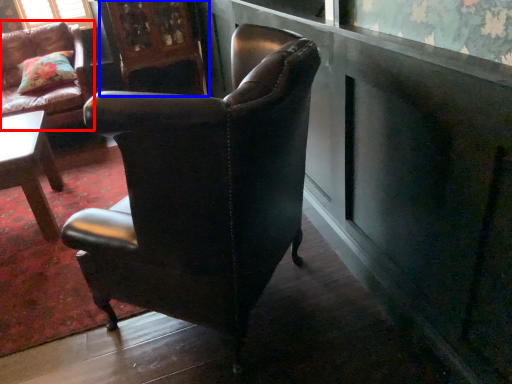
Question: Which object is further to the camera taking this photo, chair (highlighted by a red box) or armoire (highlighted by a blue box)?

Choices:
 (A) chair
 (B) armoire

Answer: (B)